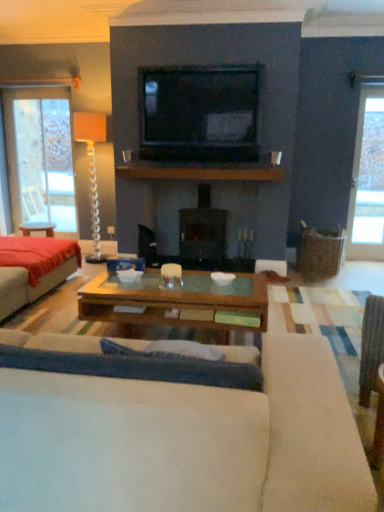
Question: Are black glossy tv at upper center and matte white coffee cup at center far apart?

Choices:
 (A) yes
 (B) no

Answer: (B)

Question: Considering the relative positions of black glossy tv at upper center and matte white coffee cup at center in the image provided, is black glossy tv at upper center to the left of matte white coffee cup at center from the viewer's perspective?

Choices:
 (A) yes
 (B) no

Answer: (B)

Question: Does black glossy tv at upper center have a larger size compared to matte white coffee cup at center?

Choices:
 (A) no
 (B) yes

Answer: (B)

Question: Is black glossy tv at upper center facing towards matte white coffee cup at center?

Choices:
 (A) no
 (B) yes

Answer: (A)

Question: Is black glossy tv at upper center behind matte white coffee cup at center?

Choices:
 (A) no
 (B) yes

Answer: (A)

Question: From a real-world perspective, is black glossy tv at upper center on matte white coffee cup at center?

Choices:
 (A) yes
 (B) no

Answer: (A)

Question: Is translucent glass floor lamp at left looking in the opposite direction of clear glass window at left, which is counted as the first window, starting from the left?

Choices:
 (A) yes
 (B) no

Answer: (B)

Question: Is translucent glass floor lamp at left further to camera compared to clear glass window at left, arranged as the second window when viewed from the front?

Choices:
 (A) no
 (B) yes

Answer: (A)

Question: Considering the relative sizes of translucent glass floor lamp at left and clear glass window at left, which ranks as the 1th window in back-to-front order, in the image provided, is translucent glass floor lamp at left wider than clear glass window at left, which ranks as the 1th window in back-to-front order,?

Choices:
 (A) yes
 (B) no

Answer: (A)

Question: Would you say translucent glass floor lamp at left contains clear glass window at left, which is counted as the first window, starting from the left?

Choices:
 (A) no
 (B) yes

Answer: (A)

Question: Considering the relative sizes of translucent glass floor lamp at left and clear glass window at left, the 2th window in the right-to-left sequence, in the image provided, is translucent glass floor lamp at left shorter than clear glass window at left, the 2th window in the right-to-left sequence,?

Choices:
 (A) yes
 (B) no

Answer: (A)

Question: Can you confirm if translucent glass floor lamp at left is smaller than clear glass window at left, which ranks as the 1th window in back-to-front order?

Choices:
 (A) yes
 (B) no

Answer: (A)

Question: Does red fabric bed at left lie in front of translucent glass floor lamp at left?

Choices:
 (A) yes
 (B) no

Answer: (A)